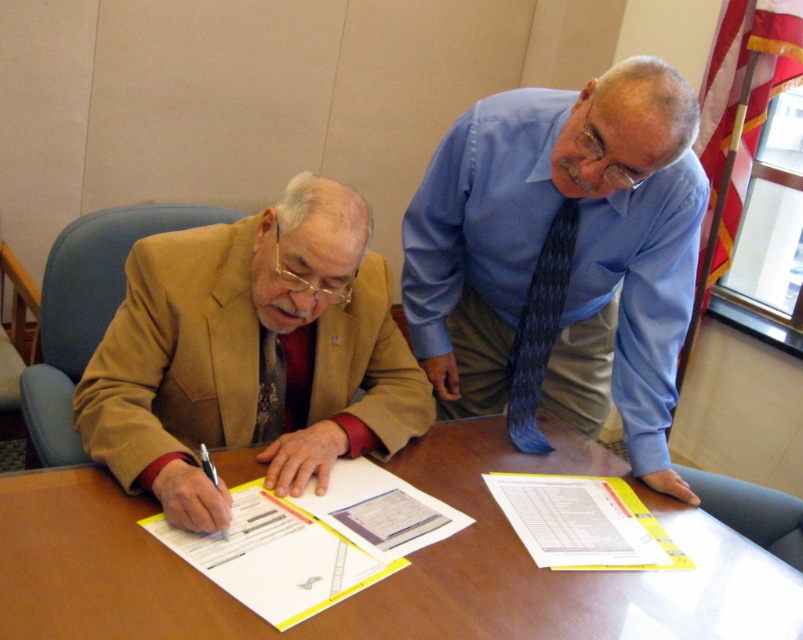
Is point (654, 323) positioned after point (418, 634)?

Yes.

Which is more to the right, blue textured shirt at upper right or brown wooden table at center?

From the viewer's perspective, blue textured shirt at upper right appears more on the right side.

Between point (590, 342) and point (726, 540), which one is positioned in front?

Point (726, 540)

Identify the location of blue textured shirt at upper right. (561, 257).

Describe the element at coordinates (251, 353) in the screenshot. I see `matte brown suit at left` at that location.

Does matte brown suit at left appear over dark red textured tie at left?

Indeed, matte brown suit at left is positioned over dark red textured tie at left.

Identify the location of matte brown suit at left. (251, 353).

Who is lower down, brown wooden table at center or yellow paper at center?

yellow paper at center

Where is `brown wooden table at center`? This screenshot has height=640, width=803. brown wooden table at center is located at coordinates (394, 573).

In order to click on brown wooden table at center in this screenshot , I will do `click(394, 573)`.